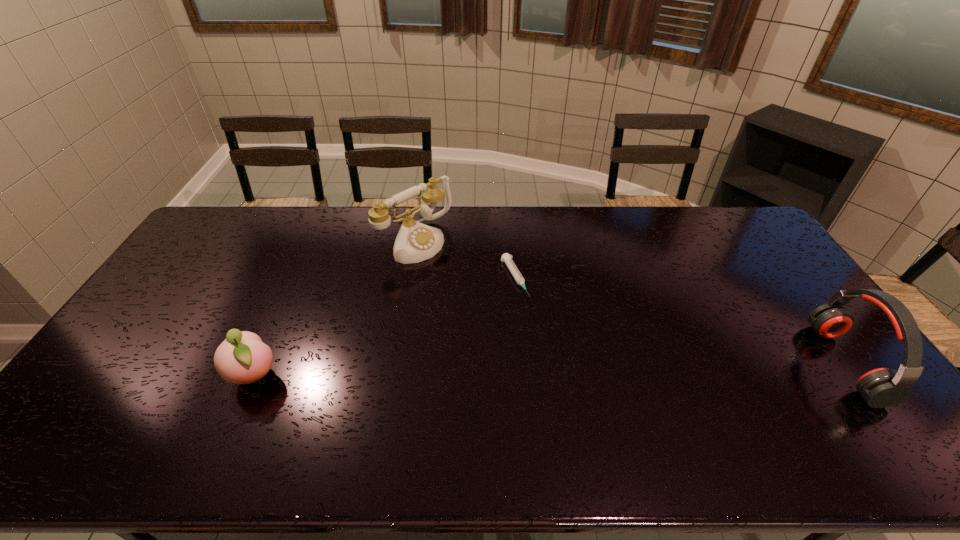
This screenshot has width=960, height=540. Find the location of `free area in between the peach and the third object from right to left`. free area in between the peach and the third object from right to left is located at coordinates (336, 308).

Locate an element on the screen. This screenshot has height=540, width=960. free area in between the rightmost object and the leftmost object is located at coordinates (550, 369).

This screenshot has width=960, height=540. In order to click on free space between the earphone and the peach in this screenshot , I will do `click(550, 369)`.

Locate an element on the screen. This screenshot has width=960, height=540. free area in between the peach and the third object from right to left is located at coordinates (336, 308).

I want to click on blank region between the third object from right to left and the shortest object, so click(x=466, y=260).

Identify the location of vacant area between the syringe and the peach. (385, 327).

What are the coordinates of `free spot between the peach and the second object from left to right` in the screenshot? It's located at (336, 308).

Identify the location of the closest object relative to the third object from right to left. Image resolution: width=960 pixels, height=540 pixels. pyautogui.click(x=507, y=258).

Where is `the third closest object to the telephone`? the third closest object to the telephone is located at coordinates (883, 387).

The width and height of the screenshot is (960, 540). What are the coordinates of `blank area in the image that satisfies the following two spatial constraints: 1. on the back side of the second shortest object; 2. on the ear cups of the rightmost object` in the screenshot? It's located at (260, 363).